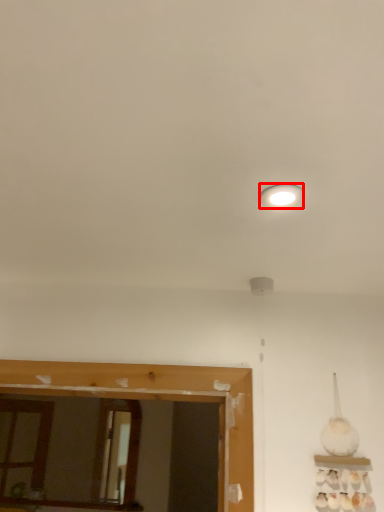
Question: From the image's perspective, where is lighting (annotated by the red box) located relative to mirror?

Choices:
 (A) below
 (B) above

Answer: (B)